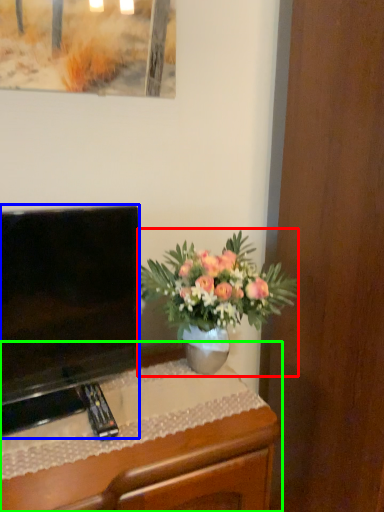
Question: Estimate the real-world distances between objects in this image. Which object is farther from houseplant (highlighted by a red box), television (highlighted by a blue box) or desk (highlighted by a green box)?

Choices:
 (A) television
 (B) desk

Answer: (B)